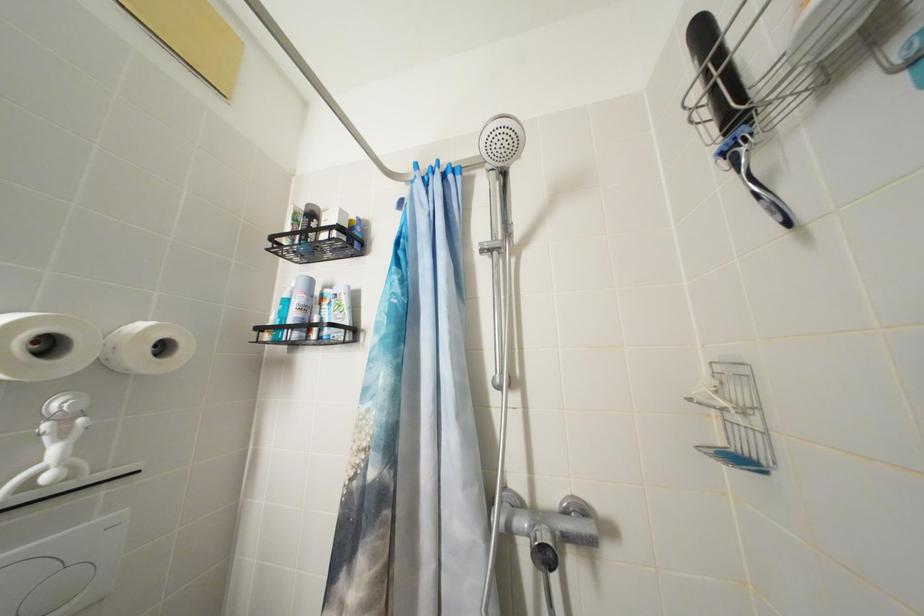
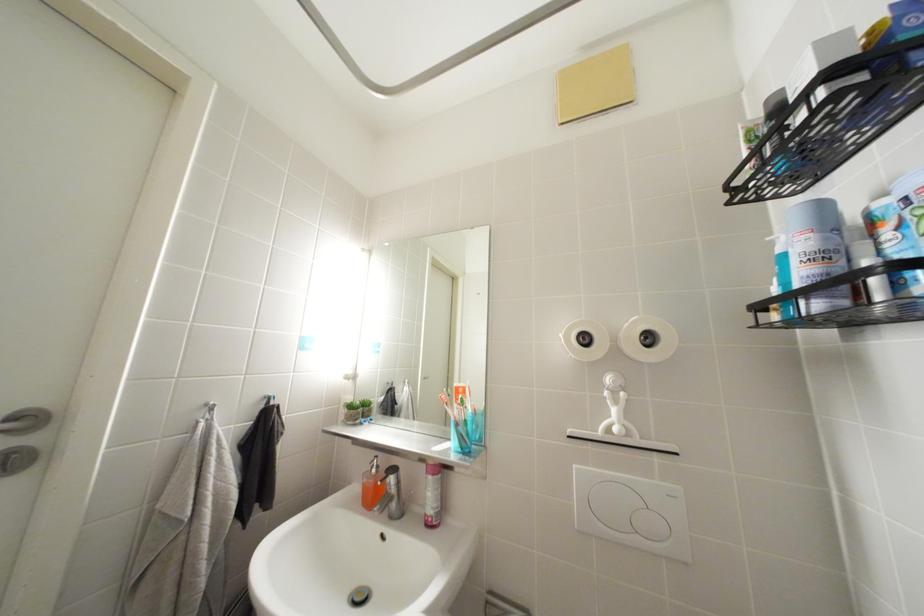
Question: The images are taken continuously from a first-person perspective. In which direction is your viewpoint rotating?

Choices:
 (A) Left
 (B) Right
 (C) Up
 (D) Down

Answer: (A)